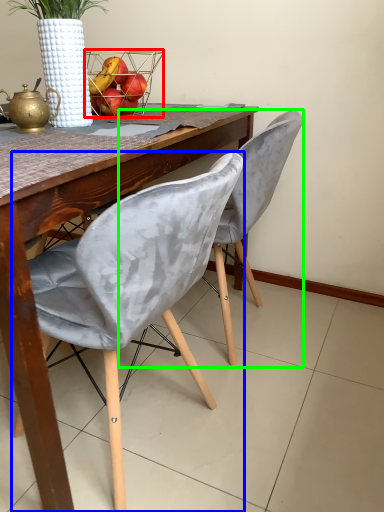
Question: Which is nearer to the basket (highlighted by a red box)? chair (highlighted by a blue box) or chair (highlighted by a green box).

Choices:
 (A) chair
 (B) chair

Answer: (B)